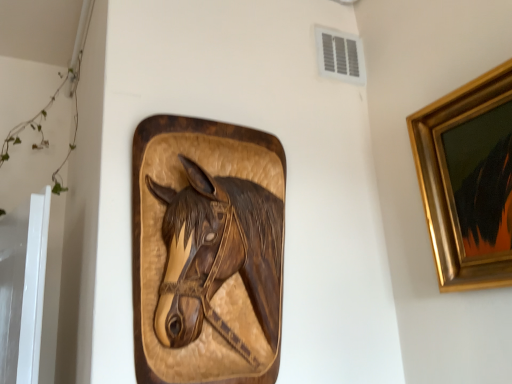
Question: Can white plastic vent at upper center be found inside gold-framed painting at upper right?

Choices:
 (A) no
 (B) yes

Answer: (A)

Question: Considering the relative sizes of gold-framed painting at upper right and white plastic vent at upper center in the image provided, is gold-framed painting at upper right shorter than white plastic vent at upper center?

Choices:
 (A) no
 (B) yes

Answer: (A)

Question: From a real-world perspective, is gold-framed painting at upper right over white plastic vent at upper center?

Choices:
 (A) no
 (B) yes

Answer: (A)

Question: Is gold-framed painting at upper right at the right side of white plastic vent at upper center?

Choices:
 (A) yes
 (B) no

Answer: (A)

Question: Can you confirm if gold-framed painting at upper right is positioned to the left of white plastic vent at upper center?

Choices:
 (A) no
 (B) yes

Answer: (A)

Question: Would you consider gold-framed painting at upper right to be distant from white plastic vent at upper center?

Choices:
 (A) no
 (B) yes

Answer: (A)

Question: From the image's perspective, would you say wooden carved horse head at center is shown under white plastic vent at upper center?

Choices:
 (A) no
 (B) yes

Answer: (B)

Question: Can you see wooden carved horse head at center touching white plastic vent at upper center?

Choices:
 (A) yes
 (B) no

Answer: (B)

Question: Does wooden carved horse head at center have a greater height compared to white plastic vent at upper center?

Choices:
 (A) yes
 (B) no

Answer: (A)

Question: From the image's perspective, would you say wooden carved horse head at center is positioned over white plastic vent at upper center?

Choices:
 (A) yes
 (B) no

Answer: (B)

Question: Considering the relative positions of wooden carved horse head at center and white plastic vent at upper center in the image provided, is wooden carved horse head at center to the right of white plastic vent at upper center from the viewer's perspective?

Choices:
 (A) no
 (B) yes

Answer: (A)

Question: Considering the relative positions of wooden carved horse head at center and white plastic vent at upper center in the image provided, is wooden carved horse head at center to the left of white plastic vent at upper center from the viewer's perspective?

Choices:
 (A) yes
 (B) no

Answer: (A)

Question: Is white plastic vent at upper center taller than gold-framed painting at upper right?

Choices:
 (A) no
 (B) yes

Answer: (A)